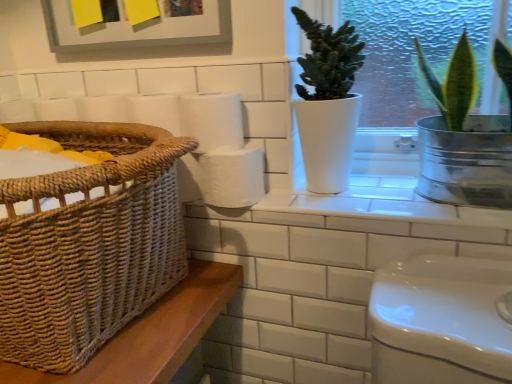
Where is `free space above white ceramic window sill at upper center (from a real-world perspective)`? This screenshot has width=512, height=384. free space above white ceramic window sill at upper center (from a real-world perspective) is located at coordinates (374, 189).